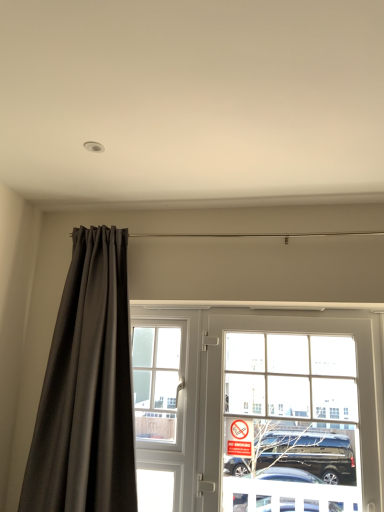
Question: Is clear glass door at center bigger than red plastic sign at center?

Choices:
 (A) no
 (B) yes

Answer: (B)

Question: Is clear glass door at center in front of red plastic sign at center?

Choices:
 (A) no
 (B) yes

Answer: (B)

Question: Does clear glass door at center have a lesser height compared to red plastic sign at center?

Choices:
 (A) yes
 (B) no

Answer: (B)

Question: Could you tell me if clear glass door at center is turned towards red plastic sign at center?

Choices:
 (A) yes
 (B) no

Answer: (A)

Question: Considering the relative sizes of clear glass door at center and red plastic sign at center in the image provided, is clear glass door at center thinner than red plastic sign at center?

Choices:
 (A) yes
 (B) no

Answer: (B)

Question: Is clear glass door at center touching red plastic sign at center?

Choices:
 (A) yes
 (B) no

Answer: (B)

Question: Can you confirm if clear glass door at center is thinner than clear glass window at center?

Choices:
 (A) no
 (B) yes

Answer: (A)

Question: From the image's perspective, is clear glass door at center located beneath clear glass window at center?

Choices:
 (A) yes
 (B) no

Answer: (A)

Question: Is clear glass door at center further to camera compared to clear glass window at center?

Choices:
 (A) no
 (B) yes

Answer: (A)

Question: Does clear glass door at center have a greater height compared to clear glass window at center?

Choices:
 (A) yes
 (B) no

Answer: (A)

Question: Is clear glass window at center located within clear glass door at center?

Choices:
 (A) no
 (B) yes

Answer: (A)

Question: Is clear glass door at center to the left of clear glass window at center from the viewer's perspective?

Choices:
 (A) no
 (B) yes

Answer: (A)

Question: From a real-world perspective, is red plastic sign at center under clear glass door at center?

Choices:
 (A) yes
 (B) no

Answer: (A)